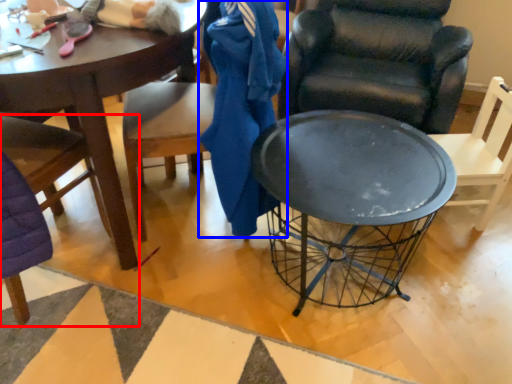
Question: Which point is closer to the camera, chair (highlighted by a red box) or clothing (highlighted by a blue box)?

Choices:
 (A) chair
 (B) clothing

Answer: (A)